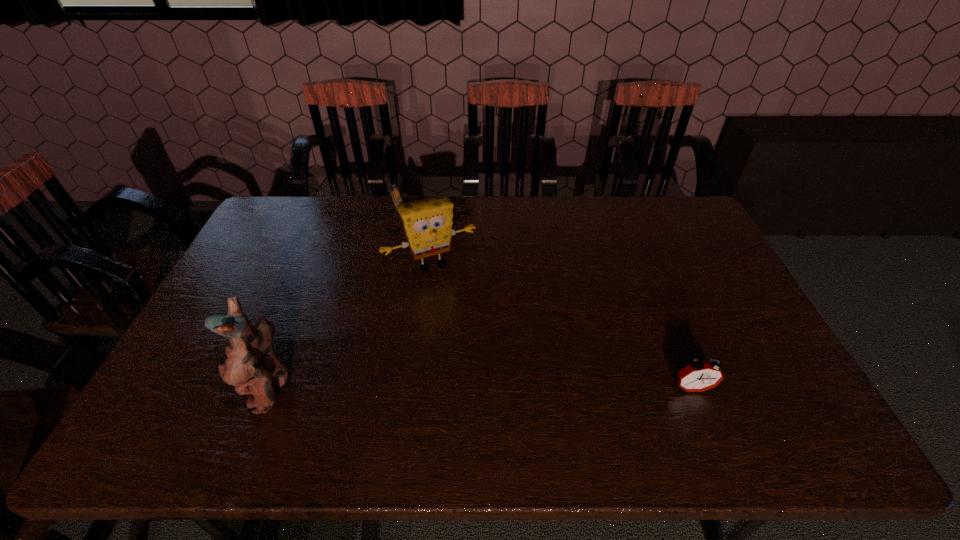
What are the coordinates of `the tallest object` in the screenshot? It's located at (249, 363).

I want to click on the leftmost object, so click(x=249, y=363).

Image resolution: width=960 pixels, height=540 pixels. Identify the location of the second shortest object. (699, 376).

Image resolution: width=960 pixels, height=540 pixels. Identify the location of alarm clock. (699, 376).

Where is `the second farthest object`? Image resolution: width=960 pixels, height=540 pixels. the second farthest object is located at coordinates (427, 223).

Identify the location of sponge. Image resolution: width=960 pixels, height=540 pixels. (427, 223).

Locate an element on the screen. This screenshot has width=960, height=540. the shortest object is located at coordinates pyautogui.click(x=396, y=196).

The image size is (960, 540). In order to click on the farthest object in this screenshot , I will do `click(396, 196)`.

This screenshot has height=540, width=960. I want to click on free location located 0.110m on the front-facing side of the leftmost object, so click(207, 389).

This screenshot has height=540, width=960. I want to click on free point located on the front-facing side of the leftmost object, so click(182, 389).